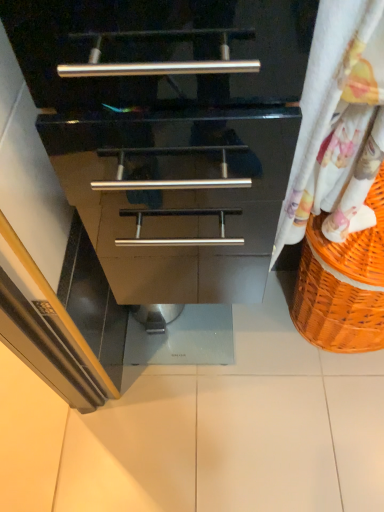
Question: From the image's perspective, is orange woven basket at right above or below white floral fabric at right?

Choices:
 (A) above
 (B) below

Answer: (B)

Question: From their relative heights in the image, would you say orange woven basket at right is taller or shorter than white floral fabric at right?

Choices:
 (A) short
 (B) tall

Answer: (A)

Question: Estimate the real-world distances between objects in this image. Which object is farther from the white glossy tile at center?

Choices:
 (A) orange woven basket at right
 (B) white floral fabric at right

Answer: (B)

Question: Which object is positioned farthest from the white floral fabric at right?

Choices:
 (A) orange woven basket at right
 (B) white glossy tile at center

Answer: (B)